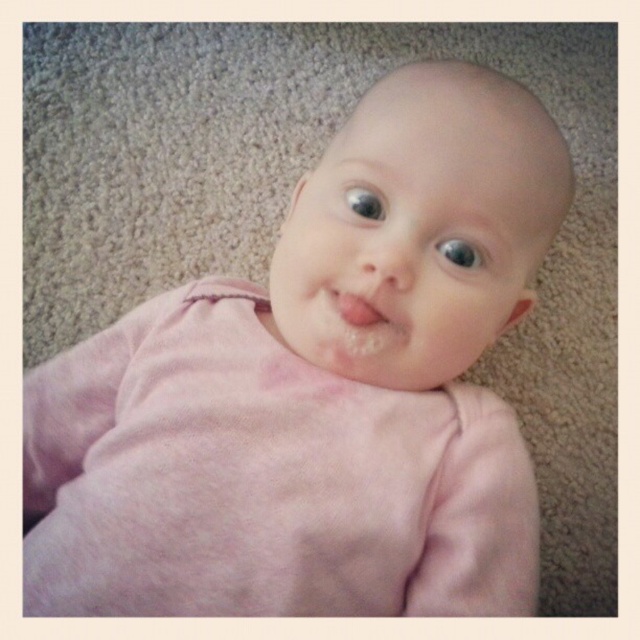
Question: Which object is farther from the camera taking this photo?

Choices:
 (A) pink matte lips at center
 (B) smooth pink baby at center
 (C) blue glossy eye at upper center
 (D) blue glossy eye at center

Answer: (C)

Question: Is blue glossy eye at center further to camera compared to blue glossy eye at upper center?

Choices:
 (A) yes
 (B) no

Answer: (B)

Question: Does blue glossy eye at center appear over blue glossy eye at upper center?

Choices:
 (A) yes
 (B) no

Answer: (B)

Question: Among these points, which one is farthest from the camera?

Choices:
 (A) (385, 320)
 (B) (452, 264)
 (C) (376, 196)
 (D) (486, 321)

Answer: (D)

Question: Estimate the real-world distances between objects in this image. Which object is closer to the smooth pink baby at center?

Choices:
 (A) blue glossy eye at upper center
 (B) pink matte lips at center
 (C) blue glossy eye at center

Answer: (C)

Question: Does blue glossy eye at center come behind blue glossy eye at upper center?

Choices:
 (A) yes
 (B) no

Answer: (B)